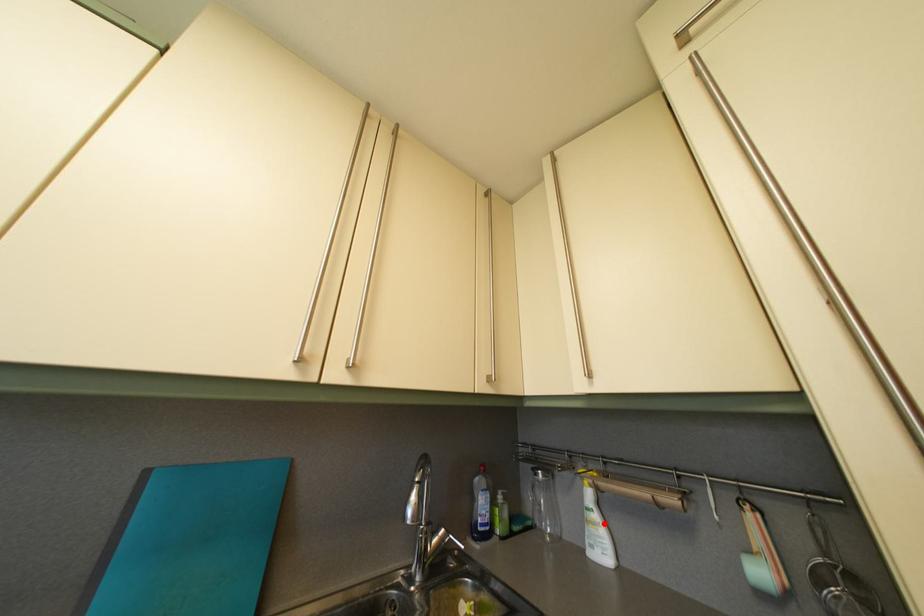
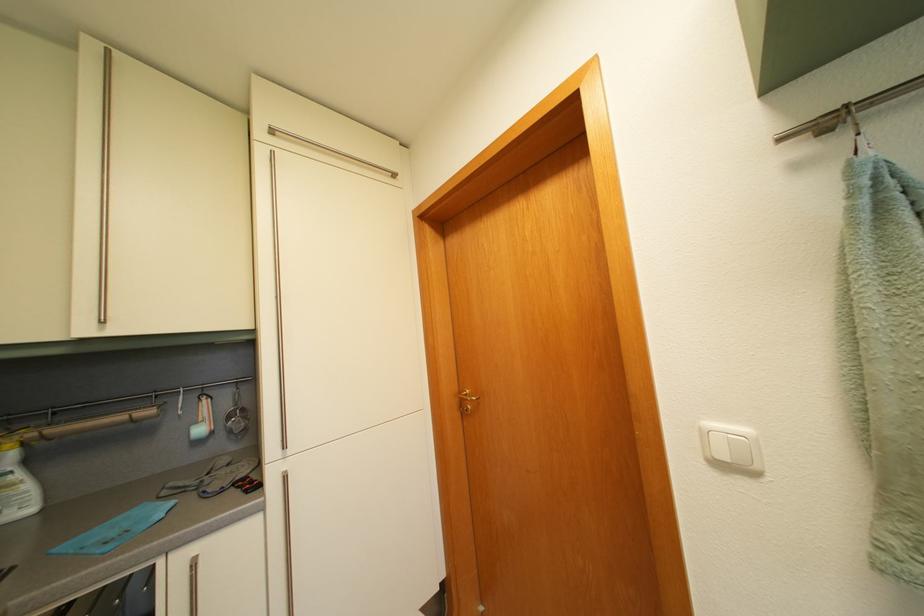
In the second image, find the point that corresponds to the highlighted location in the first image.

(26, 484)